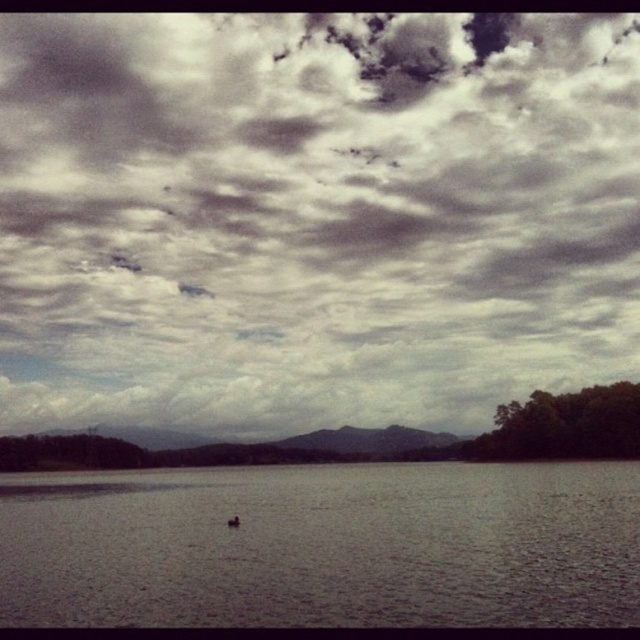
You are a photographer planning to capture the cloudy sky at upper center and the gray matte water at center in a single frame. Based on the scene, which object will occupy a larger portion of the photo vertically?

The cloudy sky at upper center will occupy a larger portion of the photo vertically since it is much taller than the gray matte water at center according to the description.

What are the coordinates of the cloudy sky at upper center in the image?

The cloudy sky at upper center is located at coordinates point (314,216).

You are an artist planning to paint the cloudy sky at upper center and the gray matte water at center. If you want to make sure both elements are proportionally accurate, which one should you paint larger?

The cloudy sky at upper center should be painted larger than the gray matte water at center because it is described as bigger in the scene.